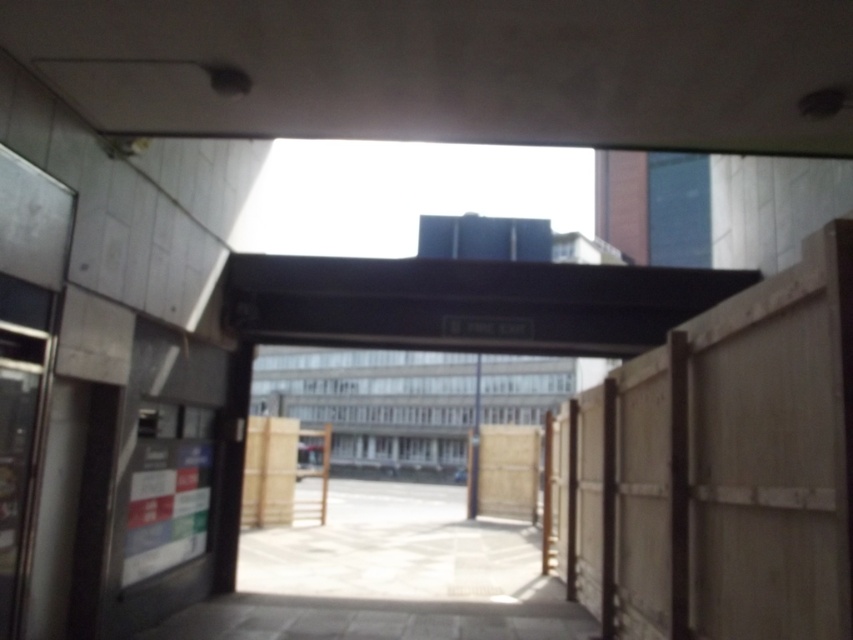
Between black matte overpass at center and gray concrete parking garage at center, which one appears on the left side from the viewer's perspective?

From the viewer's perspective, black matte overpass at center appears more on the left side.

Does black matte overpass at center have a larger size compared to gray concrete parking garage at center?

No, black matte overpass at center is not bigger than gray concrete parking garage at center.

Does point (712, 288) come in front of point (550, 388)?

Yes.

You are a GUI agent. You are given a task and a screenshot of the screen. Output one action in this format:
    pyautogui.click(x=<x>, y=<y>)
    Task: Click on the black matte overpass at center
    The width and height of the screenshot is (853, 640).
    Given the screenshot: What is the action you would take?
    (x=466, y=304)